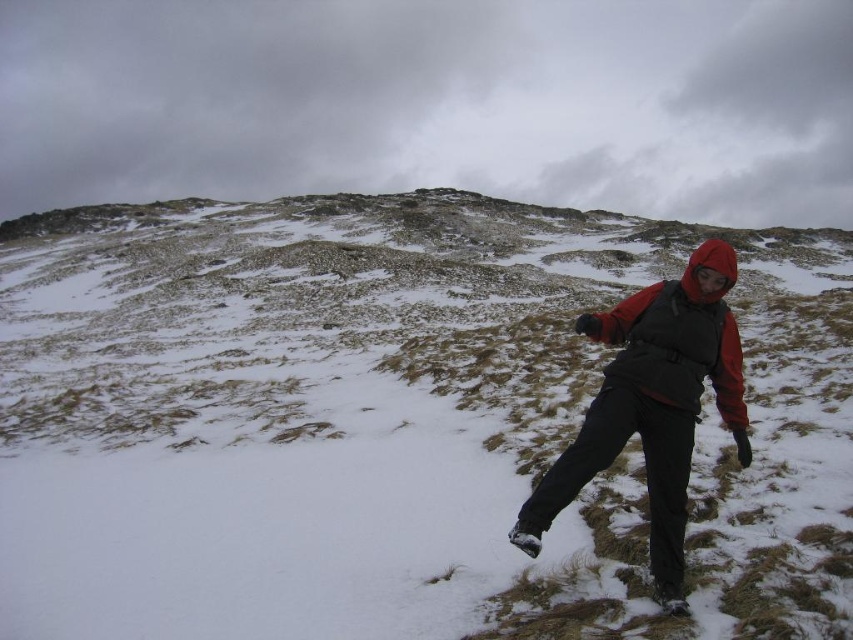
Does white powdery snow at center have a smaller size compared to matte black jacket at center?

Incorrect, white powdery snow at center is not smaller in size than matte black jacket at center.

You are a GUI agent. You are given a task and a screenshot of the screen. Output one action in this format:
    pyautogui.click(x=<x>, y=<y>)
    Task: Click on the white powdery snow at center
    
    Given the screenshot: What is the action you would take?
    pyautogui.click(x=393, y=426)

In order to click on white powdery snow at center in this screenshot , I will do `click(393, 426)`.

Can you confirm if white powdery snow at center is positioned below red fleece jacket at right?

Actually, white powdery snow at center is above red fleece jacket at right.

Who is positioned more to the right, white powdery snow at center or red fleece jacket at right?

red fleece jacket at right is more to the right.

Which is behind, point (280, 588) or point (633, 360)?

Point (633, 360)

I want to click on white powdery snow at center, so click(393, 426).

Which is more to the right, matte black jacket at center or red fleece jacket at right?

matte black jacket at center is more to the right.

In the scene shown: Measure the distance between matte black jacket at center and camera.

They are 27.07 meters apart.

You are a GUI agent. You are given a task and a screenshot of the screen. Output one action in this format:
    pyautogui.click(x=<x>, y=<y>)
    Task: Click on the matte black jacket at center
    Image resolution: width=853 pixels, height=640 pixels.
    Given the screenshot: What is the action you would take?
    pyautogui.click(x=653, y=404)